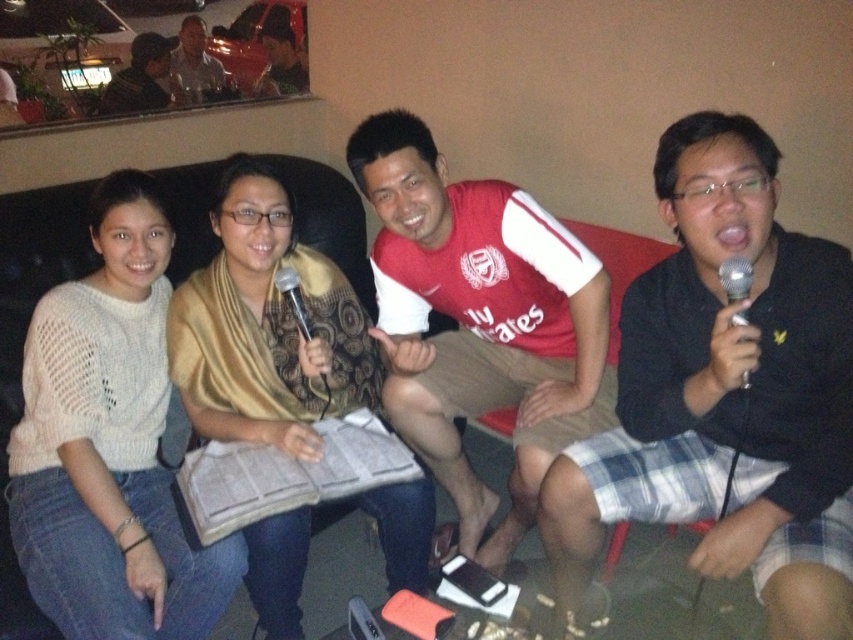
You are a photographer trying to capture a closeup shot of the pattern on the patterned silk scarf at center and the matte black shirt at upper left. Which object will require you to get closer to the subject to capture its details?

The patterned silk scarf at center requires you to get closer to capture its details because it is larger in size than the matte black shirt at upper left.

You are a sound technician in a karaoke bar. You need to adjust the volume for the silver metallic microphone at right and the metallic silver microphone at center. The microphones are 33.67 inches apart. Can you reach both microphones if your arm span is 36 inches?

The silver metallic microphone at right and metallic silver microphone at center are 33.67 inches apart from each other. Since your arm span is 36 inches, which is longer than the distance between them, you can reach both microphones.